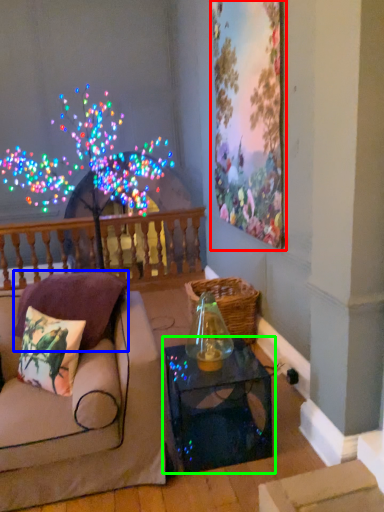
Question: Considering the real-world distances, which object is farthest from picture frame (highlighted by a red box)? pillow (highlighted by a blue box) or table (highlighted by a green box)?

Choices:
 (A) pillow
 (B) table

Answer: (A)